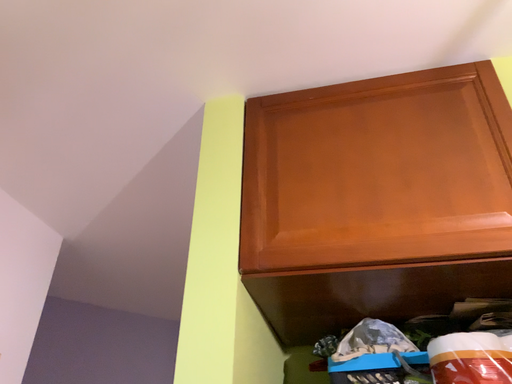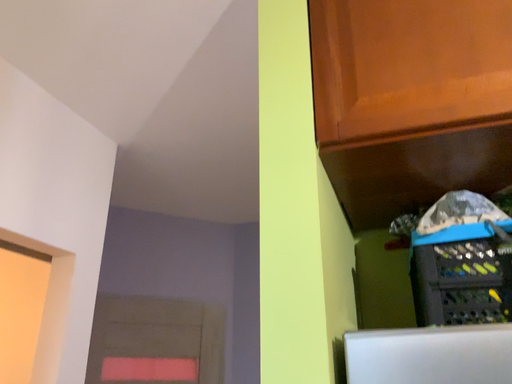
Question: How did the camera likely rotate when shooting the video?

Choices:
 (A) rotated downward
 (B) rotated upward

Answer: (A)